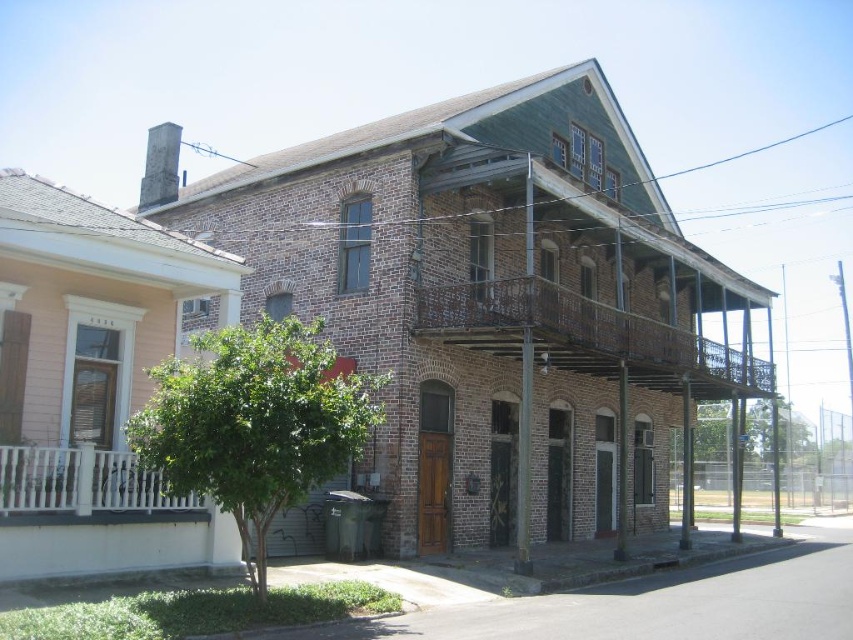
Question: Which point is farther from the camera taking this photo?

Choices:
 (A) (16, 481)
 (B) (473, 307)

Answer: (B)

Question: Does rusty metal balcony at center appear on the left side of white painted wood at left?

Choices:
 (A) yes
 (B) no

Answer: (B)

Question: From the image, what is the correct spatial relationship of rusty metal balcony at center in relation to white painted wood at left?

Choices:
 (A) right
 (B) left

Answer: (A)

Question: Is rusty metal balcony at center below white painted wood at left?

Choices:
 (A) no
 (B) yes

Answer: (A)

Question: Which point is farther to the camera?

Choices:
 (A) (508, 310)
 (B) (7, 464)

Answer: (A)